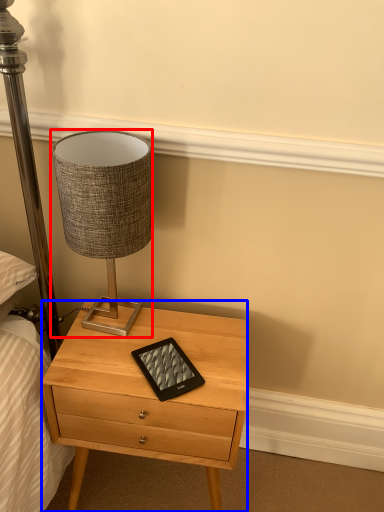
Question: Which object is further to the camera taking this photo, lamp (highlighted by a red box) or nightstand (highlighted by a blue box)?

Choices:
 (A) lamp
 (B) nightstand

Answer: (B)